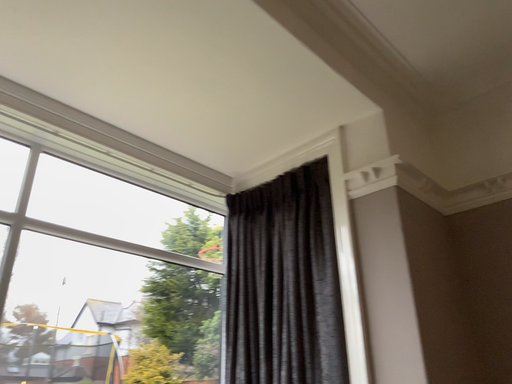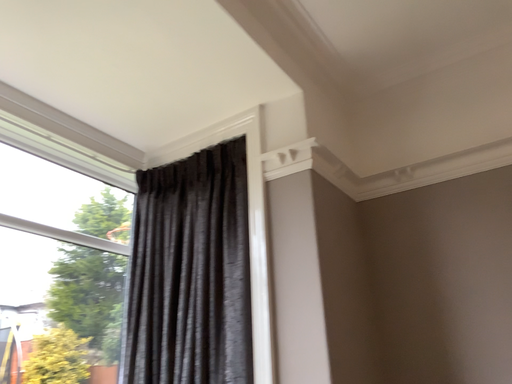
Question: How did the camera likely rotate when shooting the video?

Choices:
 (A) rotated right
 (B) rotated left

Answer: (A)